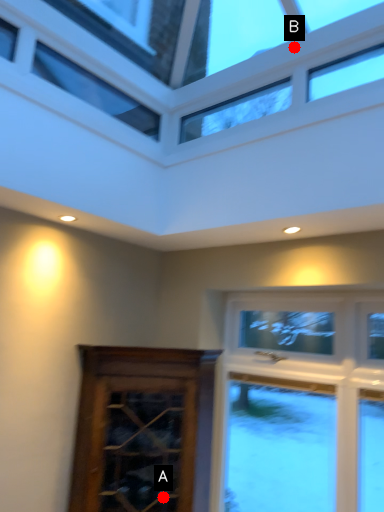
Question: Two points are circled on the image, labeled by A and B beside each circle. Among these points, which one is farthest from the camera?

Choices:
 (A) A is further
 (B) B is further

Answer: (A)